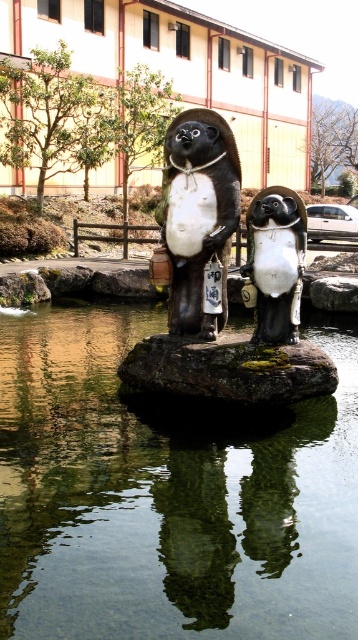
Question: Estimate the real-world distances between objects in this image. Which object is closer to the matte black penguin at center?

Choices:
 (A) shiny bronze penguin at center
 (B) clear water at center

Answer: (A)

Question: Is clear water at center to the right of matte black penguin at center from the viewer's perspective?

Choices:
 (A) yes
 (B) no

Answer: (A)

Question: Is shiny bronze penguin at center behind matte black penguin at center?

Choices:
 (A) yes
 (B) no

Answer: (B)

Question: Is clear water at center below shiny bronze penguin at center?

Choices:
 (A) yes
 (B) no

Answer: (A)

Question: Based on their relative distances, which object is farther from the matte black penguin at center?

Choices:
 (A) shiny black penguin at center
 (B) clear water at center
 (C) shiny bronze penguin at center

Answer: (B)

Question: Which point is closer to the camera taking this photo?

Choices:
 (A) (283, 216)
 (B) (211, 209)

Answer: (A)